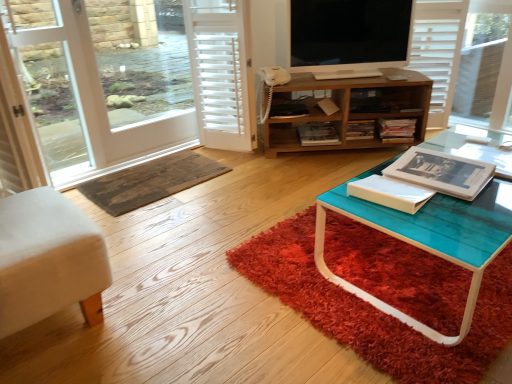
This screenshot has width=512, height=384. Find the location of `free space behind shaggy red rug at lower center, marked as the first doormat in a front-to-back arrangement`. free space behind shaggy red rug at lower center, marked as the first doormat in a front-to-back arrangement is located at coordinates (289, 172).